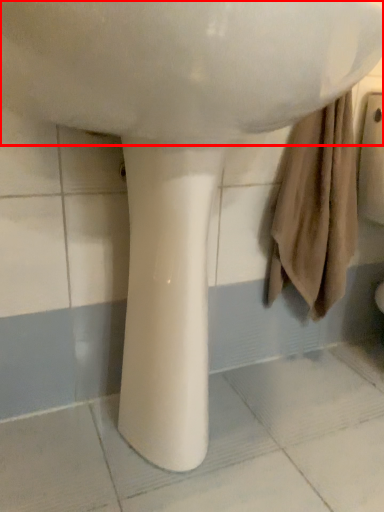
Question: From the image's perspective, where is sink (annotated by the red box) located in relation to pillar in the image?

Choices:
 (A) below
 (B) above

Answer: (B)